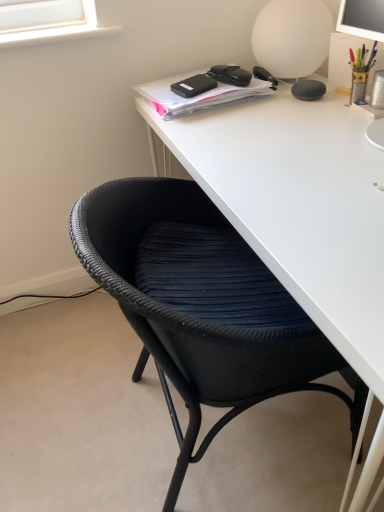
Find the location of a particular element. This screenshot has height=512, width=384. free space in front of white matte table lamp at upper right is located at coordinates (295, 103).